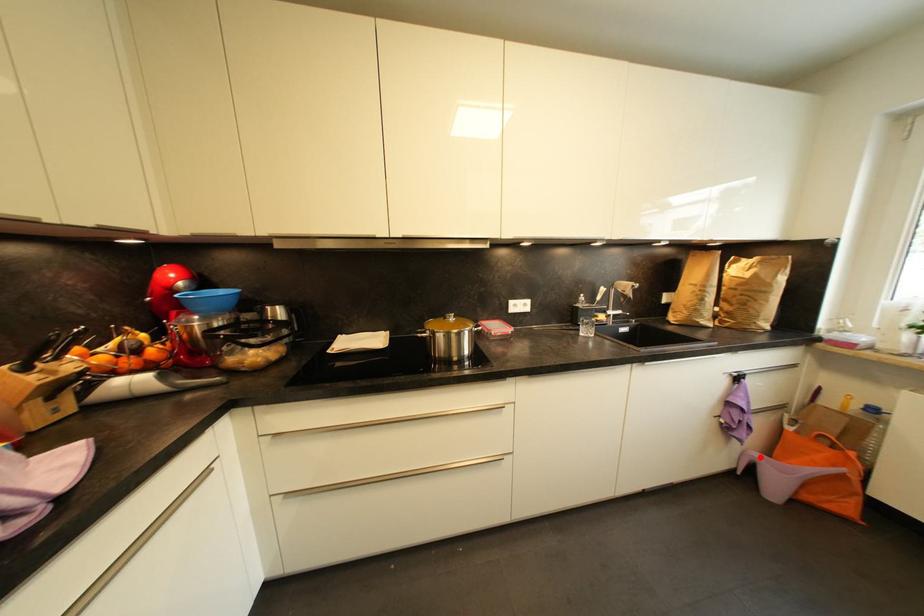
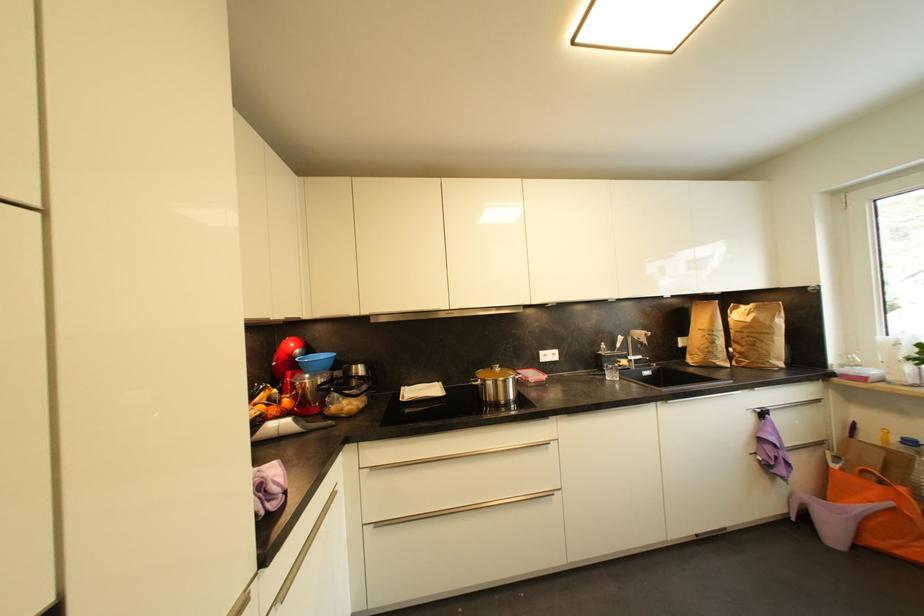
Find the pixel in the second image that matches the highlighted location in the first image.

(811, 498)